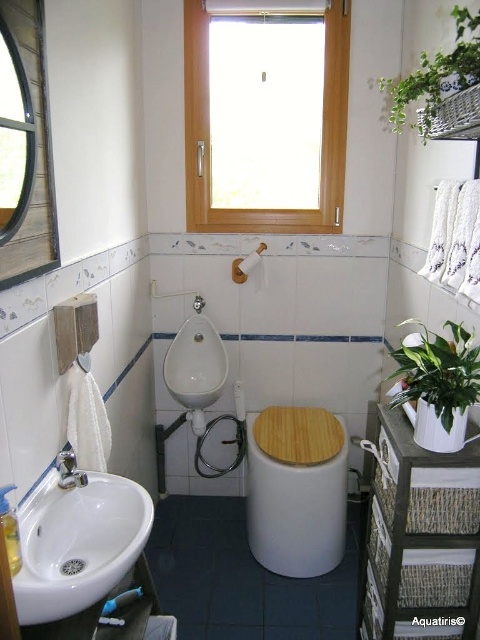
Does green leafy plant at right have a smaller size compared to brushed metal faucet at lower left?

Incorrect, green leafy plant at right is not smaller in size than brushed metal faucet at lower left.

Does green leafy plant at right have a greater width compared to brushed metal faucet at lower left?

Indeed, green leafy plant at right has a greater width compared to brushed metal faucet at lower left.

From the picture: Who is more forward, [434,374] or [66,458]?

Positioned in front is point [434,374].

This screenshot has height=640, width=480. What are the coordinates of `green leafy plant at right` in the screenshot? It's located at (437, 372).

Is wooden window at upper center further to the viewer compared to green leafy plant at upper right?

Yes, it is behind green leafy plant at upper right.

Who is lower down, wooden window at upper center or green leafy plant at upper right?

green leafy plant at upper right is below.

Locate an element on the screen. Image resolution: width=480 pixels, height=640 pixels. wooden window at upper center is located at coordinates (208, 134).

Where is `wooden window at upper center`? Image resolution: width=480 pixels, height=640 pixels. wooden window at upper center is located at coordinates [208, 134].

Is wooden window at upper center smaller than green leafy plant at right?

Actually, wooden window at upper center might be larger than green leafy plant at right.

Who is shorter, wooden window at upper center or green leafy plant at right?

Standing shorter between the two is green leafy plant at right.

Is point (195, 84) less distant than point (455, 397)?

No, (195, 84) is behind (455, 397).

At what (x,y) coordinates should I click in order to perform the action: click on wooden window at upper center. Please return your answer as a coordinate pair (x, y). Looking at the image, I should click on (208, 134).